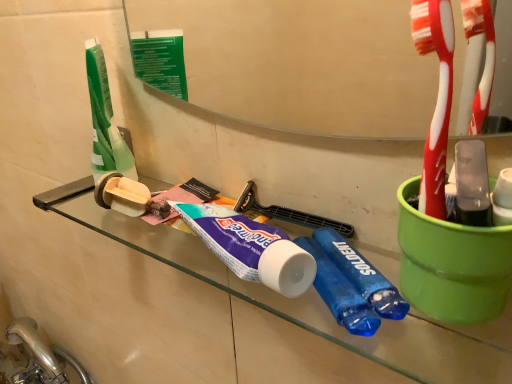
Find the location of a particular element. The width and height of the screenshot is (512, 384). free space above transparent glass shelf at center (from a real-world perspective) is located at coordinates (242, 231).